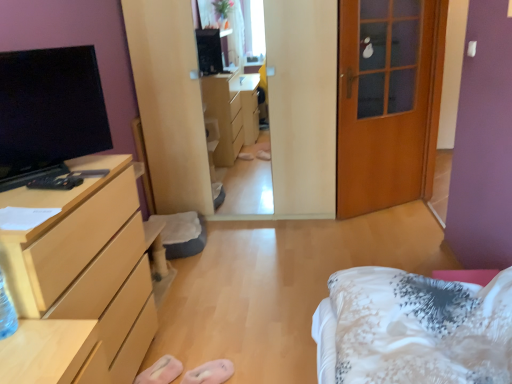
Question: In the image, is pink fabric slipper at lower center, the 2th shoe positioned from the left, positioned in front of or behind pink fabric slipper at lower center, the second shoe in the right-to-left sequence?

Choices:
 (A) behind
 (B) front

Answer: (B)

Question: From a real-world perspective, is pink fabric slipper at lower center, positioned as the 1th shoe in right-to-left order, physically located above or below pink fabric slipper at lower center, the second shoe in the right-to-left sequence?

Choices:
 (A) above
 (B) below

Answer: (B)

Question: Based on their relative distances, which object is farther from the black glossy tv at left?

Choices:
 (A) light wood/finish chest of drawers at left
 (B) pink fabric slipper at lower center, the second shoe in the right-to-left sequence
 (C) white floral fabric bed at lower right
 (D) pink fabric slipper at lower center, positioned as the 1th shoe in right-to-left order
 (E) wooden door at right

Answer: (E)

Question: Which object is positioned farthest from the pink fabric slipper at lower center, the second shoe in the right-to-left sequence?

Choices:
 (A) wooden door at right
 (B) light wood/finish chest of drawers at left
 (C) black glossy tv at left
 (D) pink fabric slipper at lower center, positioned as the 1th shoe in right-to-left order
 (E) white floral fabric bed at lower right

Answer: (A)